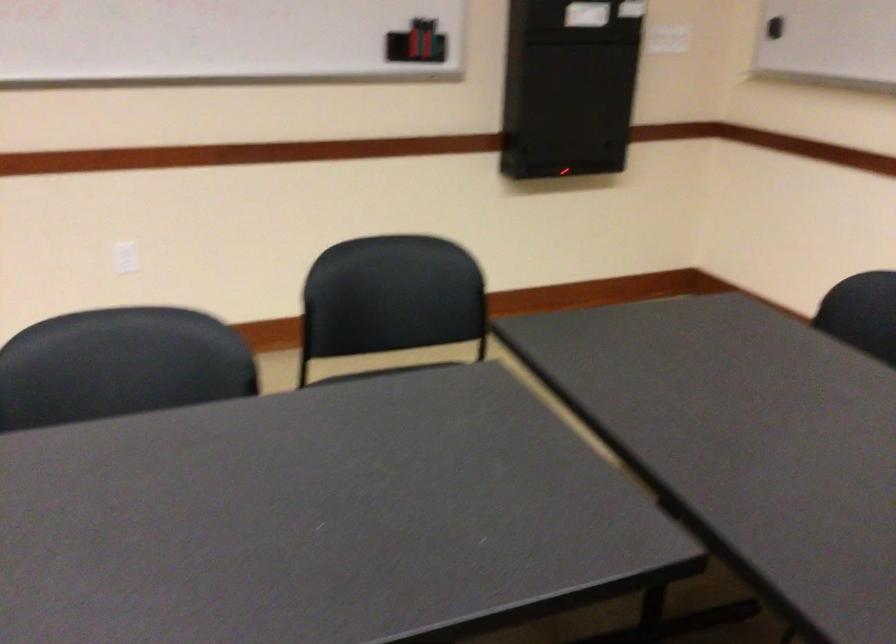
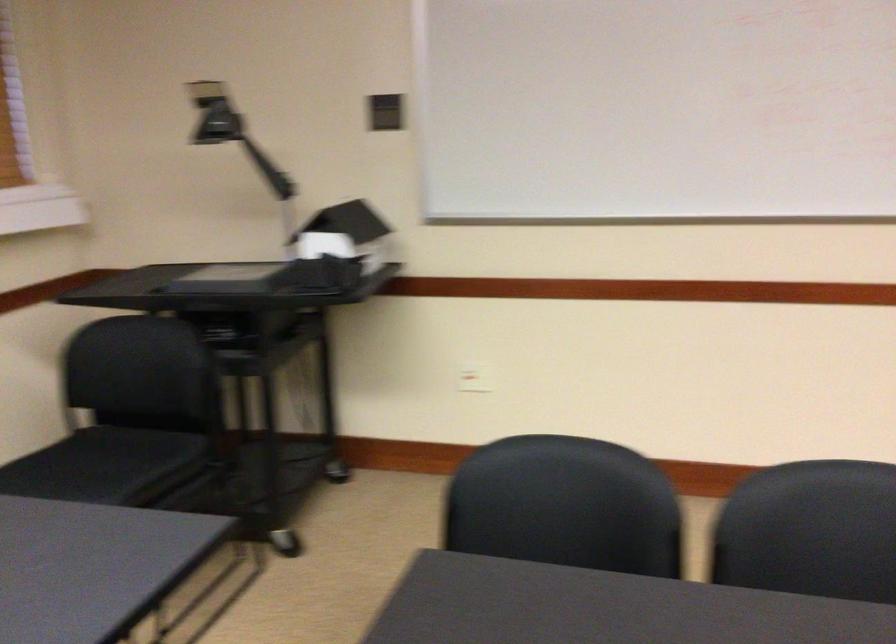
Question: How did the camera likely rotate?

Choices:
 (A) Left
 (B) Right
 (C) Up
 (D) Down

Answer: (A)